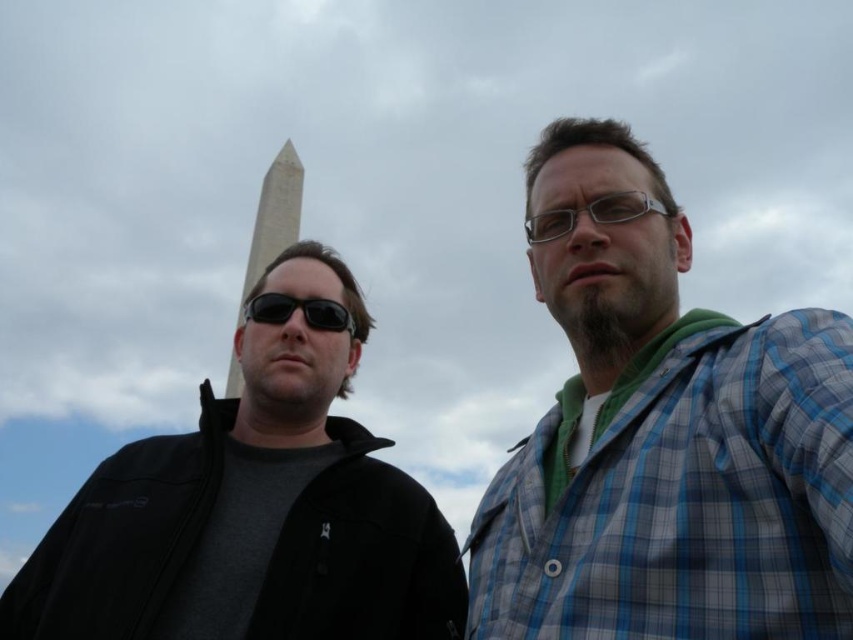
How far apart are blue plaid shirt at center and black matte jacket at left?

blue plaid shirt at center is 11.64 meters from black matte jacket at left.

Can you confirm if blue plaid shirt at center is shorter than black matte jacket at left?

In fact, blue plaid shirt at center may be taller than black matte jacket at left.

The width and height of the screenshot is (853, 640). I want to click on blue plaid shirt at center, so click(664, 436).

Looking at this image, does black matte jacket at left have a larger size compared to black matte sunglasses at center?

Correct, black matte jacket at left is larger in size than black matte sunglasses at center.

Does point (445, 596) come in front of point (354, 324)?

Yes, it is in front of point (354, 324).

Find the location of a particular element. The width and height of the screenshot is (853, 640). black matte jacket at left is located at coordinates (252, 509).

Who is positioned more to the right, blue plaid shirt at center or black matte sunglasses at center?

Positioned to the right is blue plaid shirt at center.

Is point (793, 384) more distant than point (285, 305)?

No, it is not.

At what (x,y) coordinates should I click in order to perform the action: click on blue plaid shirt at center. Please return your answer as a coordinate pair (x, y). The image size is (853, 640). Looking at the image, I should click on (664, 436).